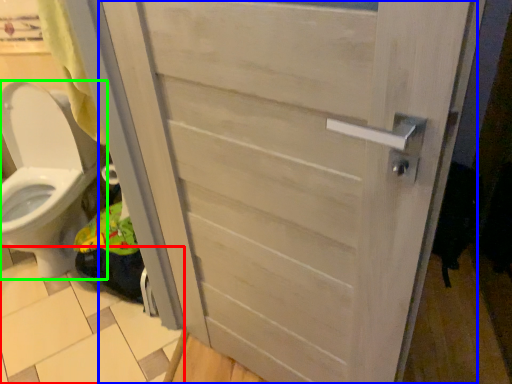
Question: Based on their relative distances, which object is farther from tile (highlighted by a red box)? Choose from door (highlighted by a blue box) and toilet (highlighted by a green box).

Choices:
 (A) door
 (B) toilet

Answer: (A)